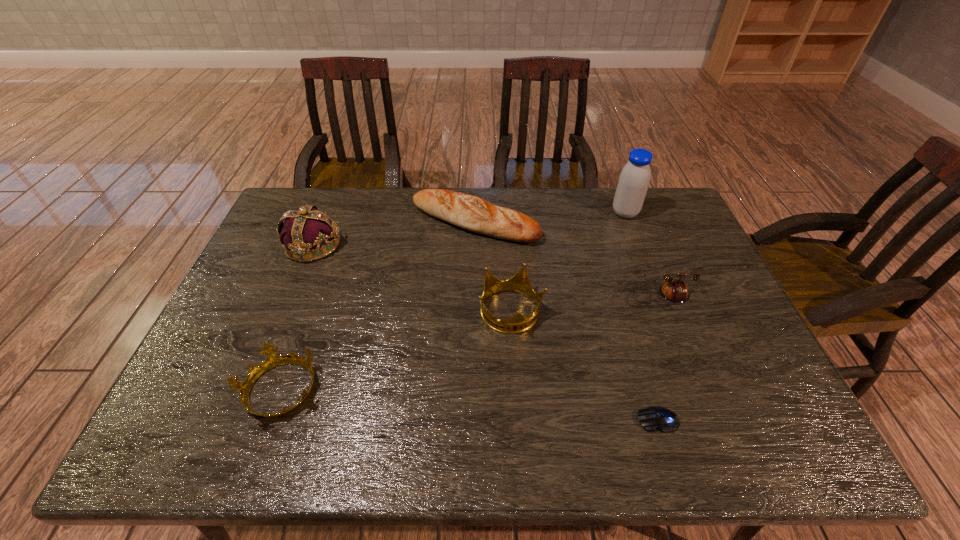
Find the location of `vacant space located on the front of the sixth shortest object`. vacant space located on the front of the sixth shortest object is located at coordinates (269, 355).

This screenshot has width=960, height=540. I want to click on free space located 0.390m on the left of the second nearest crown, so click(x=337, y=312).

In order to click on vacant area located on the left of the baguet in this screenshot , I will do `click(364, 222)`.

Locate an element on the screen. vacant space located on the rotary dial of the telephone is located at coordinates (719, 450).

Locate an element on the screen. Image resolution: width=960 pixels, height=540 pixels. vacant area situated on the back of the shortest crown is located at coordinates (305, 319).

Where is `free location located on the button side of the computer mouse`? The image size is (960, 540). free location located on the button side of the computer mouse is located at coordinates (569, 420).

Identify the location of free space located 0.340m on the button side of the computer mouse. (485, 420).

The image size is (960, 540). Identify the location of free space located 0.130m on the button side of the computer mouse. (579, 420).

Where is `soya milk present at the far edge`? This screenshot has height=540, width=960. soya milk present at the far edge is located at coordinates (634, 179).

Find the location of a particular element. crown present at the far edge is located at coordinates (305, 229).